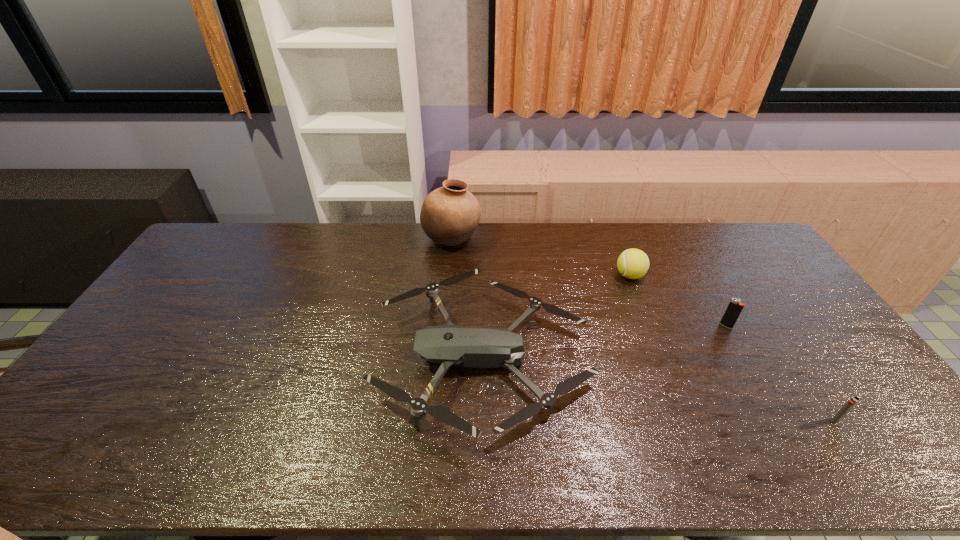
I want to click on vacant area located on the right of the farther igniter, so click(778, 326).

Locate an element on the screen. blank space located 0.240m on the front of the third object from right to left is located at coordinates (656, 341).

This screenshot has width=960, height=540. In order to click on vacant space located on the front of the shorter igniter in this screenshot , I will do `click(853, 446)`.

Image resolution: width=960 pixels, height=540 pixels. In order to click on vacant space located with a camera mounted on the front of the drone in this screenshot , I will do `click(259, 357)`.

Locate an element on the screen. The width and height of the screenshot is (960, 540). free space located 0.230m with a camera mounted on the front of the drone is located at coordinates (295, 357).

Identify the location of vacant space located with a camera mounted on the front of the drone. (302, 357).

Where is `object positioned at the far edge`? The image size is (960, 540). object positioned at the far edge is located at coordinates (449, 215).

What are the coordinates of `object that is at the near edge` in the screenshot? It's located at (471, 347).

The image size is (960, 540). Identify the location of object at the right edge. (850, 403).

Find the location of a particular element. Image resolution: width=960 pixels, height=540 pixels. vacant space at the far edge is located at coordinates (289, 226).